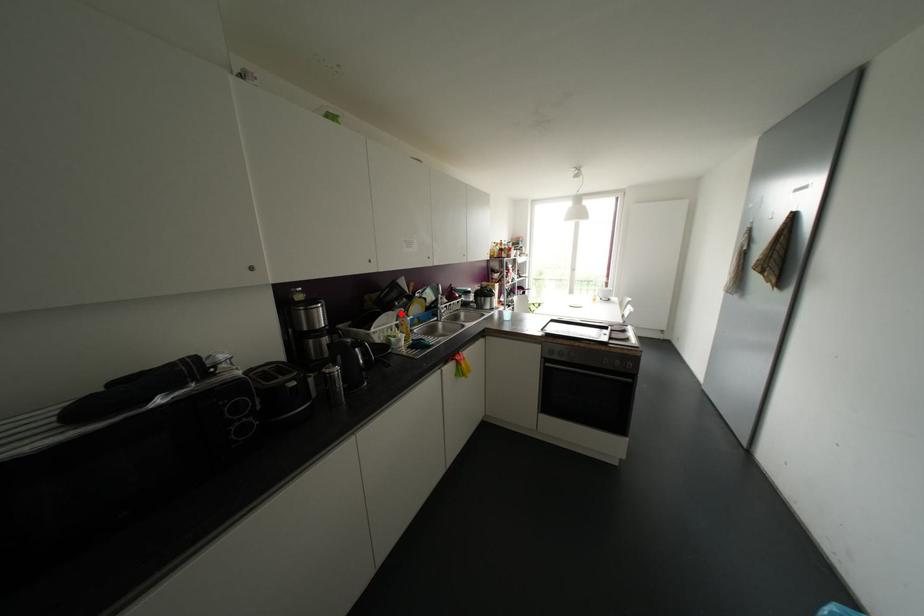
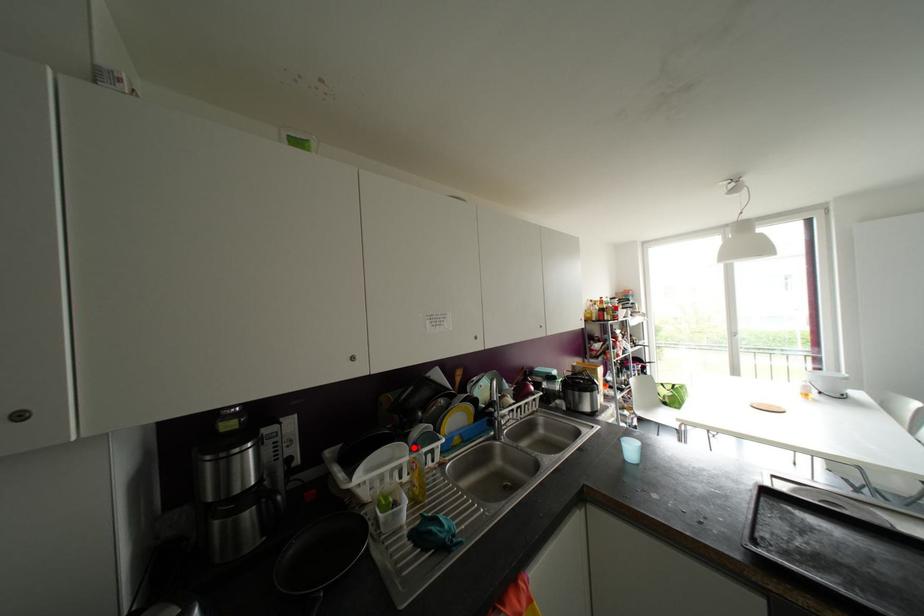
I am providing you with two images of the same scene from different viewpoints. A red point is marked on the first image and another point is marked on the second image. Does the point marked in image1 correspond to the same location as the one in image2?

Yes